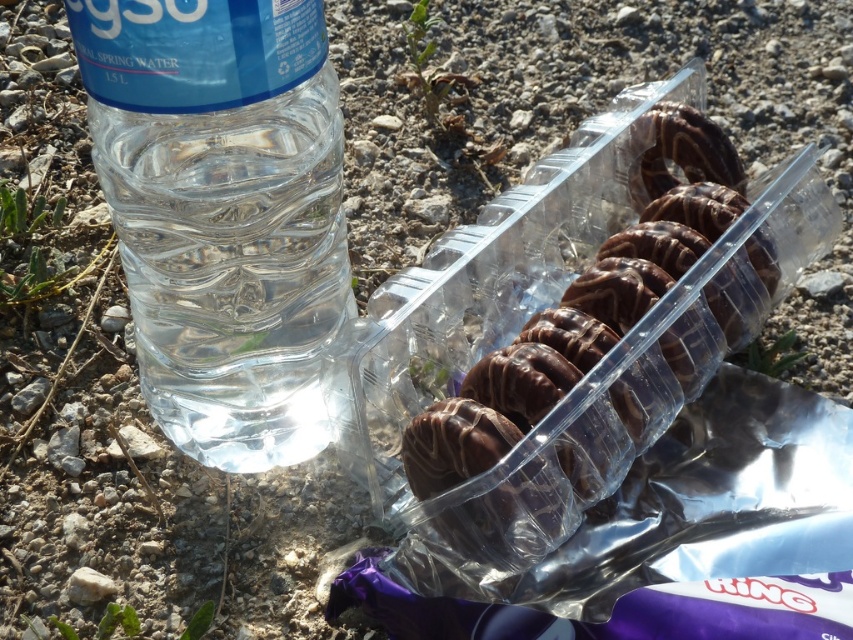
Question: Which point is farther to the camera?

Choices:
 (A) chocolate-coated cookies at center
 (B) transparent plastic bottle at left

Answer: (A)

Question: Is transparent plastic bottle at left positioned in front of chocolate-coated cookies at center?

Choices:
 (A) yes
 (B) no

Answer: (A)

Question: Among these points, which one is farthest from the camera?

Choices:
 (A) (287, 416)
 (B) (416, 420)

Answer: (A)

Question: Can you confirm if transparent plastic bottle at left is smaller than chocolate-coated cookies at center?

Choices:
 (A) no
 (B) yes

Answer: (B)

Question: Which point is closer to the camera?

Choices:
 (A) (757, 272)
 (B) (270, 208)

Answer: (B)

Question: Can you confirm if transparent plastic bottle at left is bigger than chocolate-coated cookies at center?

Choices:
 (A) yes
 (B) no

Answer: (B)